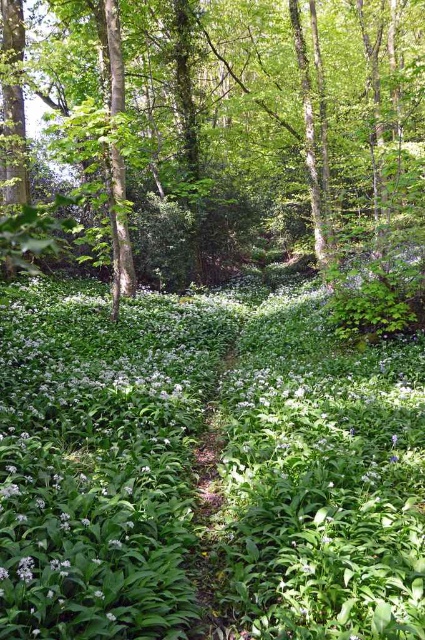
Question: Is white matte flowers at center thinner than green leafy tree at center?

Choices:
 (A) no
 (B) yes

Answer: (B)

Question: Which point is farther to the camera?

Choices:
 (A) white matte flowers at center
 (B) green leafy tree at center

Answer: (B)

Question: Is white matte flowers at center smaller than green leafy tree at center?

Choices:
 (A) yes
 (B) no

Answer: (A)

Question: Among these objects, which one is farthest from the camera?

Choices:
 (A) green leafy tree at center
 (B) white matte flowers at center

Answer: (A)

Question: Can you confirm if white matte flowers at center is positioned below green leafy tree at center?

Choices:
 (A) yes
 (B) no

Answer: (A)